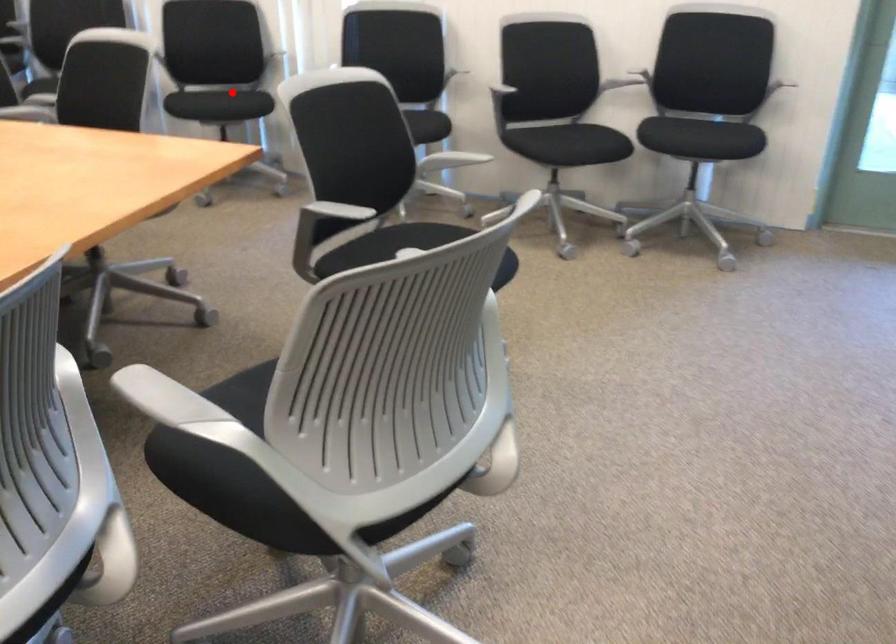
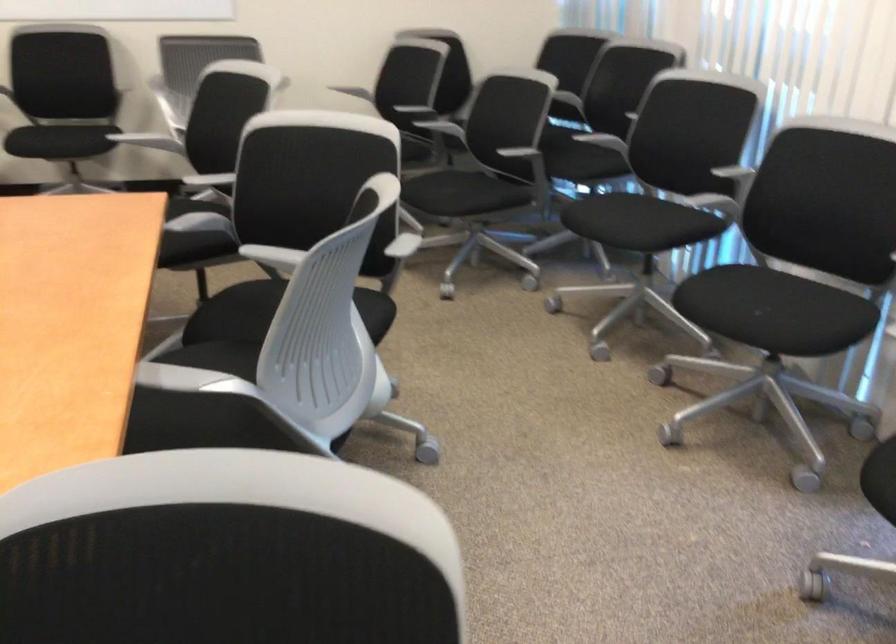
Question: I am providing you with two images of the same scene from different viewpoints. Given a red point in image1, look at the same physical point in image2. Is it:

Choices:
 (A) Closer to the viewpoint
 (B) Farther from the viewpoint

Answer: (A)